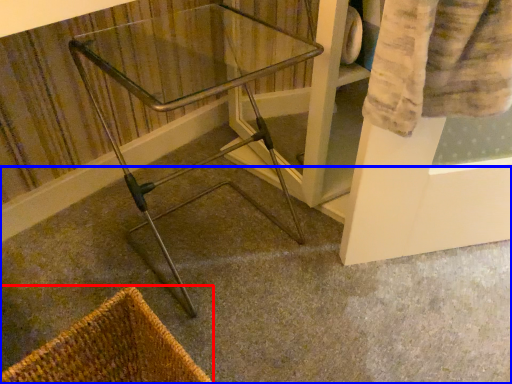
Question: Which object is further to the camera taking this photo, basket (highlighted by a red box) or concrete (highlighted by a blue box)?

Choices:
 (A) basket
 (B) concrete

Answer: (B)